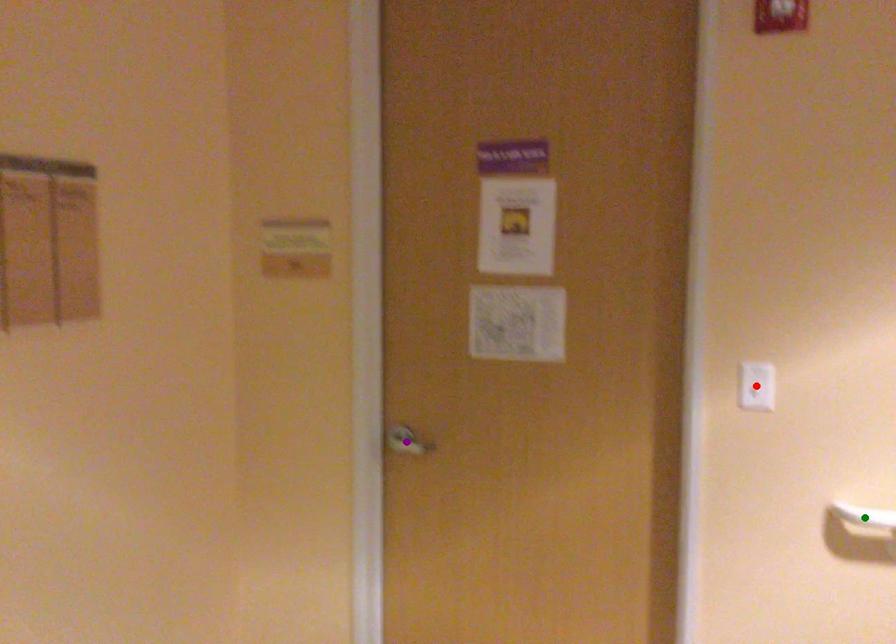
Order these from nearest to farthest:
A) purple point
B) red point
C) green point

purple point → red point → green point